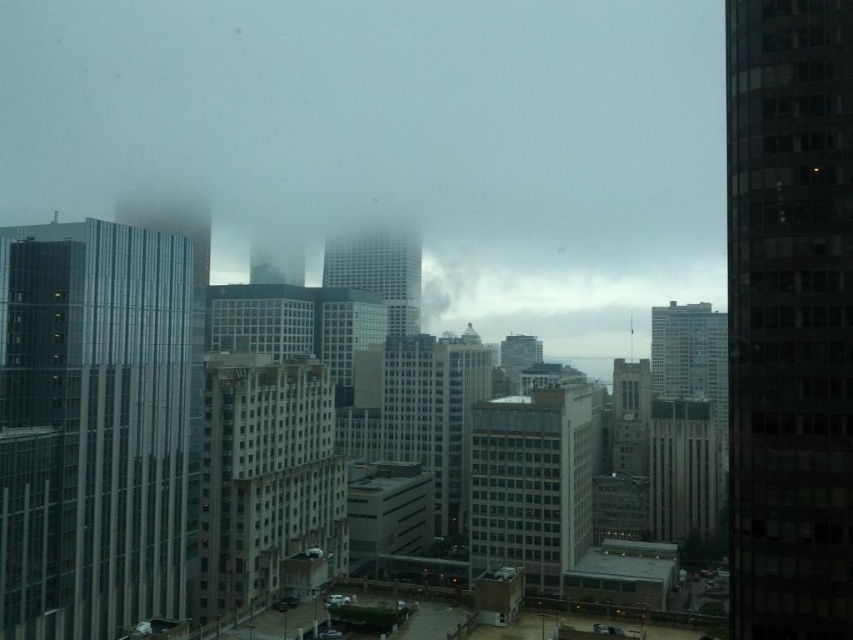
Which of these two, light beige stone building at center or glassy reflective skyscraper at center, stands shorter?

light beige stone building at center

In order to click on light beige stone building at center in this screenshot , I will do `click(265, 476)`.

I want to click on light beige stone building at center, so click(x=265, y=476).

From the picture: Is gray concrete building at center taller than glassy reflective skyscraper at center?

Incorrect, gray concrete building at center's height is not larger of glassy reflective skyscraper at center's.

Is the position of gray concrete building at center less distant than that of glassy reflective skyscraper at center?

Yes, it is in front of glassy reflective skyscraper at center.

You are a GUI agent. You are given a task and a screenshot of the screen. Output one action in this format:
    pyautogui.click(x=<x>, y=<y>)
    Task: Click on the gray concrete building at center
    The image size is (853, 640).
    Given the screenshot: What is the action you would take?
    pyautogui.click(x=532, y=481)

Is glassy reflective skyscraper at left positioned at the back of white fluffy cloud at center?

No, glassy reflective skyscraper at left is closer to the viewer.

Who is more distant from viewer, (16, 282) or (569, 269)?

Point (569, 269)

You are a GUI agent. You are given a task and a screenshot of the screen. Output one action in this format:
    pyautogui.click(x=<x>, y=<y>)
    Task: Click on the glassy reflective skyscraper at left
    
    Given the screenshot: What is the action you would take?
    pyautogui.click(x=93, y=428)